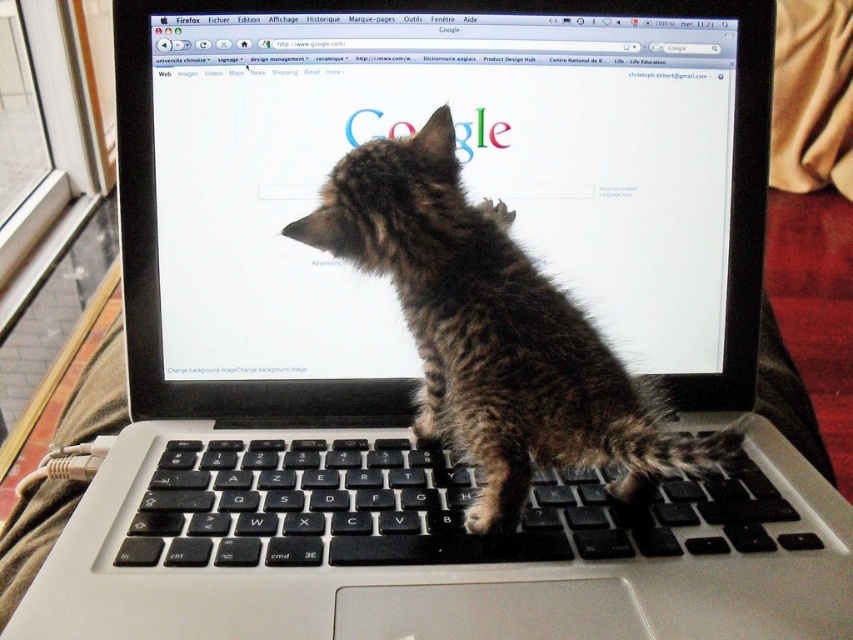
Is brown fur kitten at center positioned before black matte keyboard at center?

Yes, it is in front of black matte keyboard at center.

Who is more forward, (712, 445) or (206, 508)?

Point (712, 445)

Is point (563, 397) positioned after point (679, 525)?

That is False.

Find the location of a particular element. brown fur kitten at center is located at coordinates (494, 333).

Is matte black laptop at center shorter than brown fur kitten at center?

No.

Can you confirm if matte black laptop at center is smaller than brown fur kitten at center?

Yes, matte black laptop at center is smaller than brown fur kitten at center.

Is point (219, 74) closer to viewer compared to point (413, 204)?

No, it is behind (413, 204).

Locate an element on the screen. This screenshot has height=640, width=853. matte black laptop at center is located at coordinates (461, 173).

Is matte black laptop at center to the left of black matte keyboard at center from the viewer's perspective?

Yes, matte black laptop at center is to the left of black matte keyboard at center.

The height and width of the screenshot is (640, 853). Describe the element at coordinates (461, 173) in the screenshot. I see `matte black laptop at center` at that location.

Where is `matte black laptop at center`? Image resolution: width=853 pixels, height=640 pixels. matte black laptop at center is located at coordinates (461, 173).